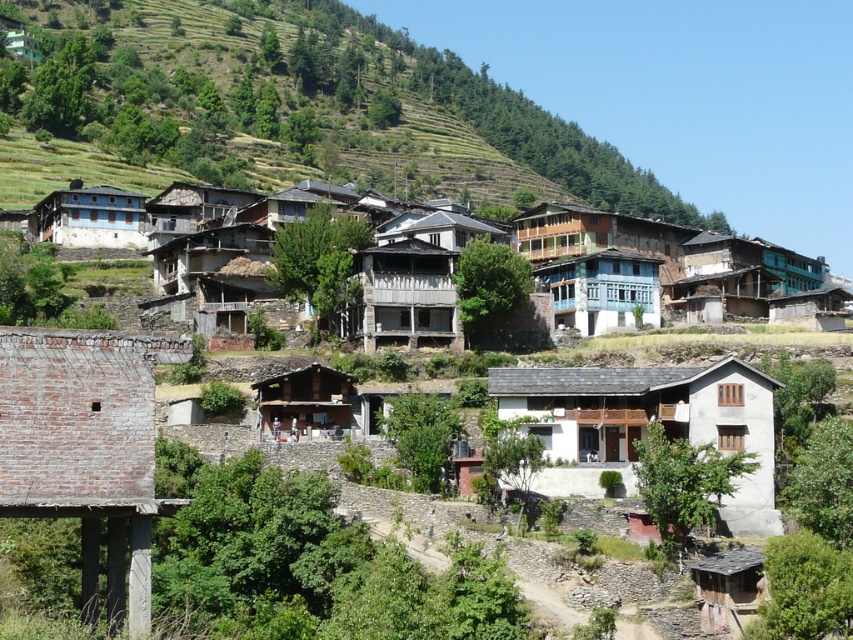
Question: Estimate the real-world distances between objects in this image. Which object is farther from the wooden balcony at center?

Choices:
 (A) wooden hut at center
 (B) wooden house at center
 (C) brick wall at lower left

Answer: (C)

Question: Can you confirm if blue painted wood house at center is bigger than wooden hut at center?

Choices:
 (A) yes
 (B) no

Answer: (A)

Question: Is green grassy hillside at upper center positioned at the back of blue painted wooden house at center?

Choices:
 (A) no
 (B) yes

Answer: (B)

Question: Is brick wall at lower left thinner than white concrete house at center?

Choices:
 (A) yes
 (B) no

Answer: (A)

Question: Which object is farther from the camera taking this photo?

Choices:
 (A) white concrete house at center
 (B) wooden balcony at center
 (C) blue painted wooden house at center

Answer: (C)

Question: Which of the following is the closest to the observer?

Choices:
 (A) [537, 253]
 (B) [239, 22]
 (C) [602, 273]

Answer: (C)